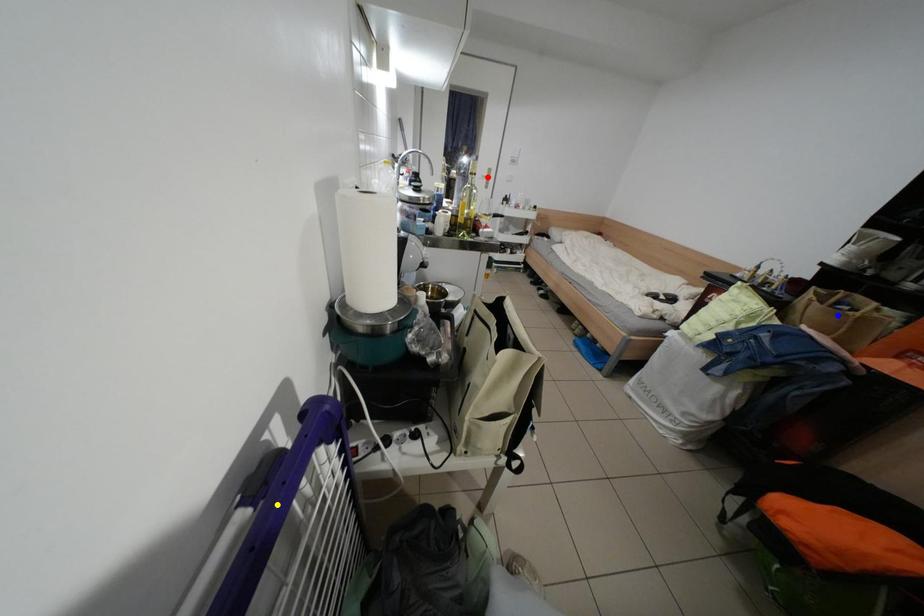
Order these from nearest to farthest:
A) red point
B) yellow point
C) blue point

red point < blue point < yellow point